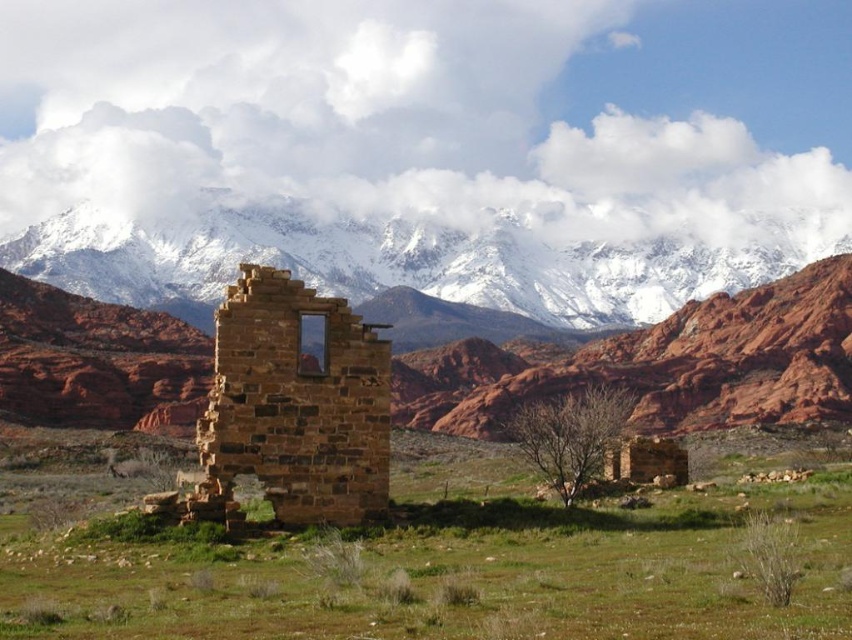
Question: Where is snowy granite mountain range at upper center located in relation to brown stone ruins at center in the image?

Choices:
 (A) above
 (B) below

Answer: (A)

Question: Among these objects, which one is nearest to the camera?

Choices:
 (A) snowy granite mountain range at upper center
 (B) brown stone ruins at center

Answer: (B)

Question: Does snowy granite mountain range at upper center have a greater width compared to brown stone ruins at center?

Choices:
 (A) no
 (B) yes

Answer: (B)

Question: Which point is closer to the camera taking this photo?

Choices:
 (A) (314, 388)
 (B) (455, 259)

Answer: (A)

Question: Does snowy granite mountain range at upper center appear under brown stone ruins at center?

Choices:
 (A) no
 (B) yes

Answer: (A)

Question: Which of the following is the farthest from the observer?

Choices:
 (A) brown stone ruins at center
 (B) snowy granite mountain range at upper center

Answer: (B)